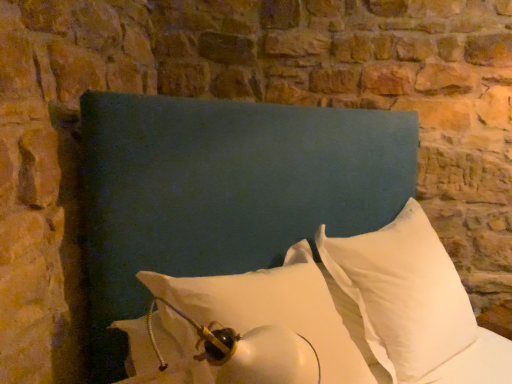
Question: Is teal fabric headboard at center at the right side of white matte pillow at center, placed as the second pillow when sorted from right to left?

Choices:
 (A) yes
 (B) no

Answer: (A)

Question: From the image's perspective, would you say teal fabric headboard at center is positioned over white matte pillow at center, placed as the second pillow when sorted from right to left?

Choices:
 (A) yes
 (B) no

Answer: (A)

Question: Can you confirm if teal fabric headboard at center is smaller than white matte pillow at center, the first pillow viewed from the left?

Choices:
 (A) yes
 (B) no

Answer: (B)

Question: Can you confirm if teal fabric headboard at center is shorter than white matte pillow at center, placed as the second pillow when sorted from right to left?

Choices:
 (A) no
 (B) yes

Answer: (A)

Question: Is teal fabric headboard at center far away from white matte pillow at center, placed as the second pillow when sorted from right to left?

Choices:
 (A) yes
 (B) no

Answer: (B)

Question: Does teal fabric headboard at center have a larger size compared to white matte pillow at center, the first pillow viewed from the left?

Choices:
 (A) no
 (B) yes

Answer: (B)

Question: Are white matte pillow at center, placed as the second pillow when sorted from right to left, and white soft pillow at center, which appears as the 2th pillow when viewed from the left, located far from each other?

Choices:
 (A) yes
 (B) no

Answer: (B)

Question: From a real-world perspective, does white matte pillow at center, placed as the second pillow when sorted from right to left, sit lower than white soft pillow at center, which appears as the 2th pillow when viewed from the left?

Choices:
 (A) no
 (B) yes

Answer: (B)

Question: Does white matte pillow at center, placed as the second pillow when sorted from right to left, have a smaller size compared to white soft pillow at center, which appears as the 2th pillow when viewed from the left?

Choices:
 (A) no
 (B) yes

Answer: (B)

Question: Can you confirm if white matte pillow at center, placed as the second pillow when sorted from right to left, is taller than white soft pillow at center, positioned as the first pillow in right-to-left order?

Choices:
 (A) no
 (B) yes

Answer: (A)

Question: Can you confirm if white matte pillow at center, the first pillow viewed from the left, is thinner than white soft pillow at center, positioned as the first pillow in right-to-left order?

Choices:
 (A) no
 (B) yes

Answer: (A)

Question: Is white matte pillow at center, placed as the second pillow when sorted from right to left, behind white soft pillow at center, positioned as the first pillow in right-to-left order?

Choices:
 (A) yes
 (B) no

Answer: (B)

Question: Is the surface of white matte pillow at center, the first pillow viewed from the left, in direct contact with teal fabric headboard at center?

Choices:
 (A) no
 (B) yes

Answer: (A)